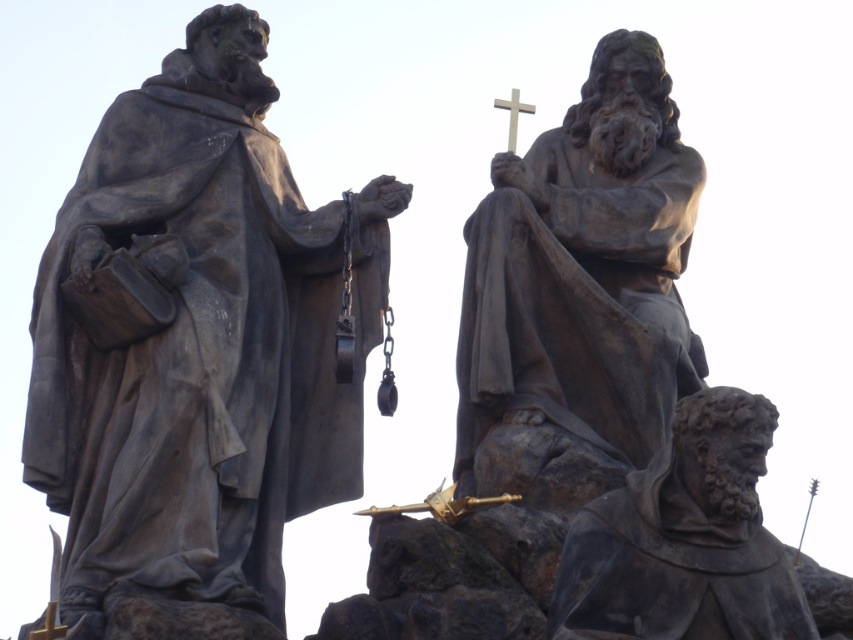
Question: Which of these objects is positioned farthest from the bronze statue of jesus holding cross at center?

Choices:
 (A) metallic gold cross at upper center
 (B) matte gray statue at left

Answer: (B)

Question: Observing the image, what is the correct spatial positioning of dark gray stone statue at lower right in reference to gold metallic crucifix at center?

Choices:
 (A) below
 (B) above

Answer: (B)

Question: Which point is farther to the camera?

Choices:
 (A) (264, 225)
 (B) (354, 512)

Answer: (A)

Question: Does bronze statue of jesus holding cross at center appear under gold metallic crucifix at center?

Choices:
 (A) no
 (B) yes

Answer: (A)

Question: Estimate the real-world distances between objects in this image. Which object is farther from the matte gray statue at left?

Choices:
 (A) metallic gold cross at upper center
 (B) dark gray stone statue at lower right

Answer: (B)

Question: Does matte gray statue at left appear on the right side of metallic gold cross at upper center?

Choices:
 (A) yes
 (B) no

Answer: (B)